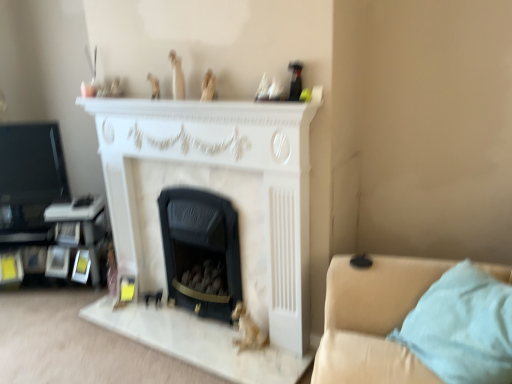
Question: Is point (179, 96) positioned closer to the camera than point (154, 84)?

Choices:
 (A) closer
 (B) farther

Answer: (A)

Question: Which is correct: white matte statue at upper center, the 2th toy viewed from the left, is inside wooden figurine at upper center, the 1th toy viewed from the left, or outside of it?

Choices:
 (A) outside
 (B) inside

Answer: (A)

Question: Based on their relative distances, which object is nearer to the white marble fireplace at center, which is the 1th fireplace in left-to-right order?

Choices:
 (A) light beige fabric studio couch at lower right
 (B) matte beige figurine at upper center, which is the 3th toy in top-to-bottom order
 (C) wooden figurine at upper center, the third toy positioned from the bottom
 (D) white matte statue at upper center, the 2th toy viewed from the left
 (E) black matte fireplace at center, which is the second fireplace from left to right

Answer: (E)

Question: Based on their relative distances, which object is nearer to the matte beige figurine at upper center, acting as the second toy starting from the bottom?

Choices:
 (A) white marble fireplace at center, which is the 2th fireplace from right to left
 (B) gold metallic figurine at lower center, acting as the 1th toy starting from the right
 (C) white matte statue at upper center, the third toy positioned from the right
 (D) wooden figurine at upper center, the third toy positioned from the bottom
 (E) light beige fabric studio couch at lower right

Answer: (C)